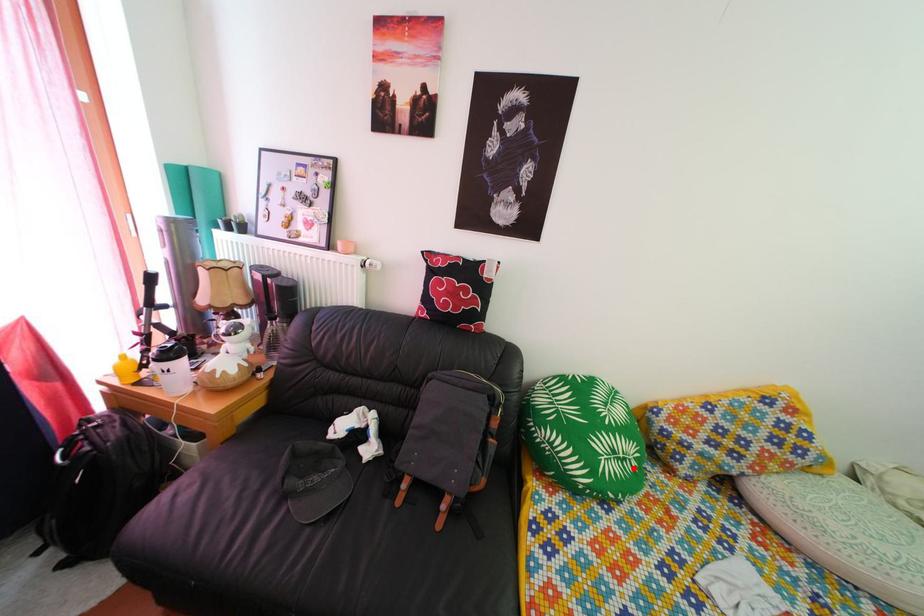
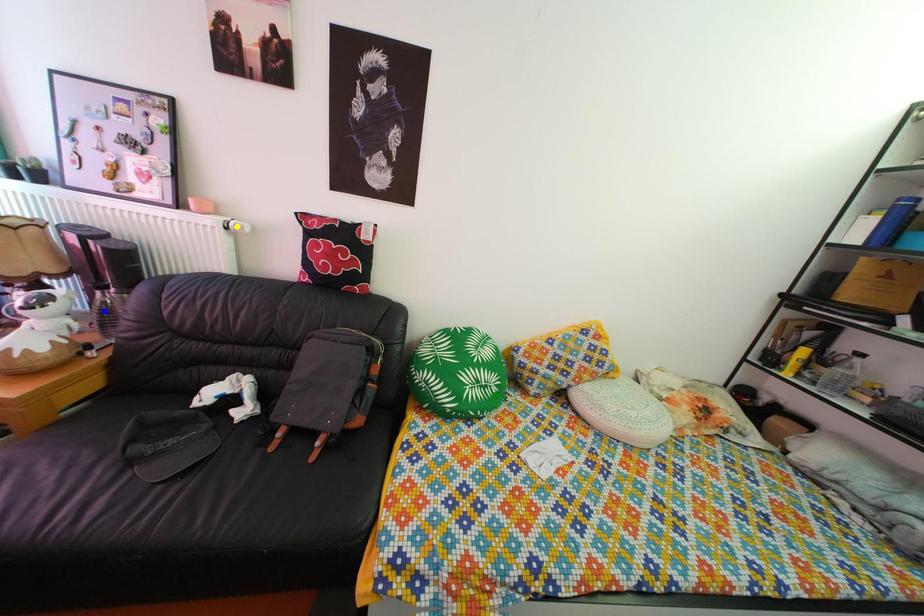
Question: I am providing you with two images of the same scene from different viewpoints. A red point is marked on the first image. You are given multiple points on the second image. Which spot in image 2 lines up with the point in image 1?

Choices:
 (A) blue point
 (B) yellow point
 (C) green point

Answer: (C)